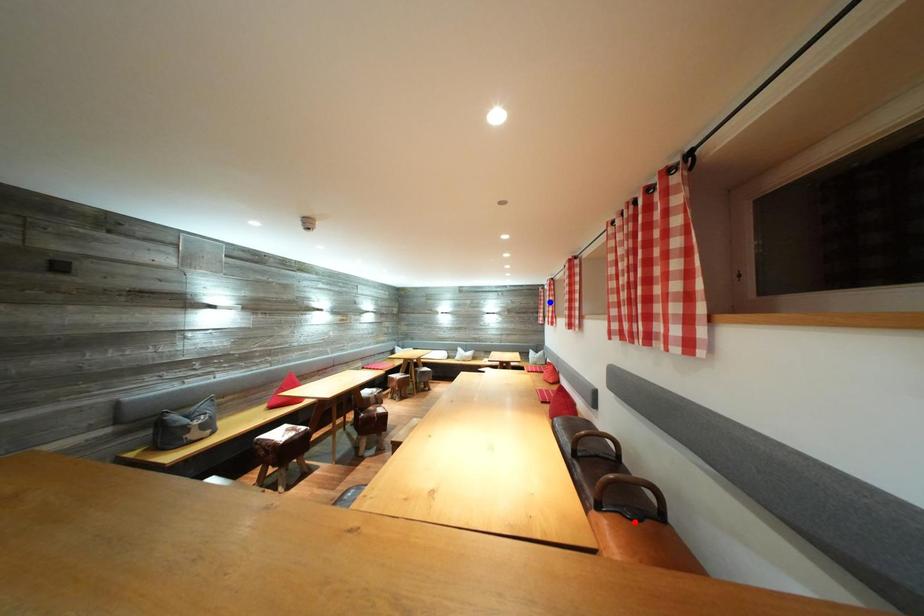
Question: In the image, two points are highlighted. Which point is nearer to the camera? Reply with the corresponding letter.

Choices:
 (A) blue point
 (B) red point

Answer: (B)